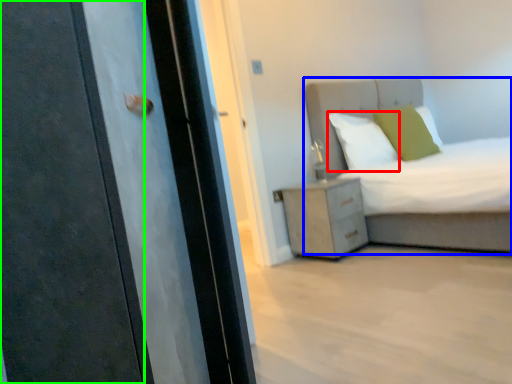
Question: Which is nearer to the pillow (highlighted by a red box)? bed (highlighted by a blue box) or door (highlighted by a green box).

Choices:
 (A) bed
 (B) door

Answer: (A)